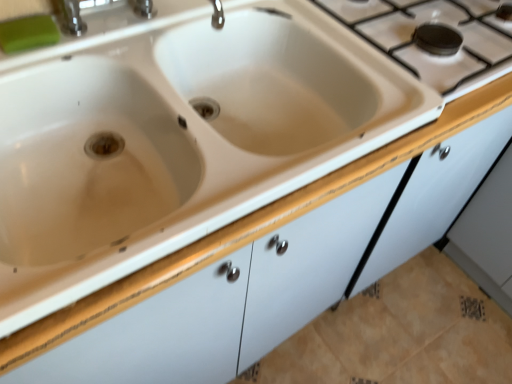
I want to click on free space to the right of green rubber soap at upper left, so click(x=106, y=40).